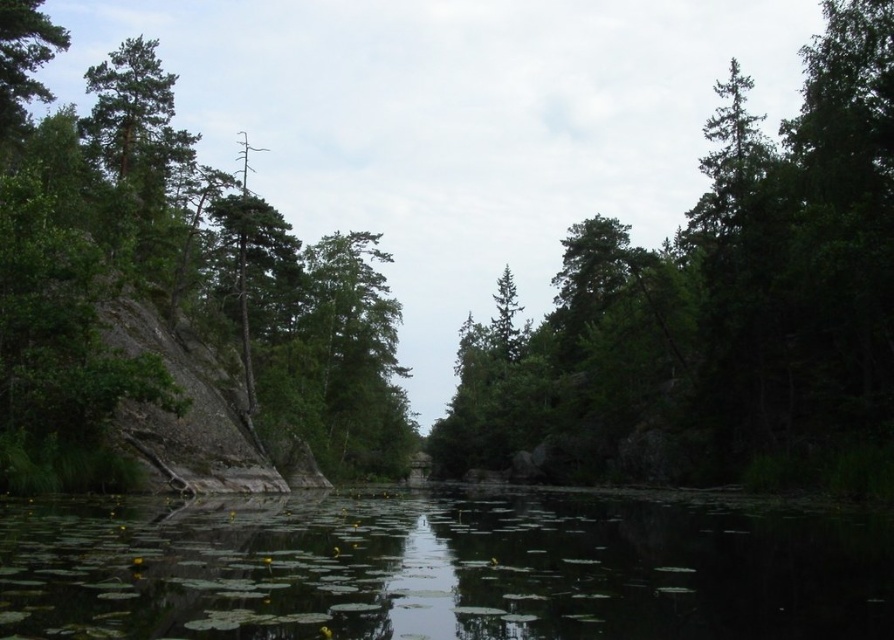
Is green leafy tree at center in front of green leafy river at center?

No, green leafy tree at center is behind green leafy river at center.

Locate an element on the screen. The height and width of the screenshot is (640, 894). green leafy tree at center is located at coordinates (714, 301).

Find the location of a particular element. The height and width of the screenshot is (640, 894). green leafy tree at center is located at coordinates (x=714, y=301).

Between point (620, 355) and point (6, 253), which one is positioned in front?

Point (6, 253)

Is point (650, 355) more distant than point (61, 124)?

Yes, it is behind point (61, 124).

Measure the distance between point (881, 42) and camera.

A distance of 49.57 meters exists between point (881, 42) and camera.

Identify the location of green leafy tree at center. This screenshot has width=894, height=640. (714, 301).

Is green leafy river at center above green rough rock at left?

Incorrect, green leafy river at center is not positioned above green rough rock at left.

You are a GUI agent. You are given a task and a screenshot of the screen. Output one action in this format:
    pyautogui.click(x=<x>, y=<y>)
    Task: Click on the green leafy river at center
    Image resolution: width=894 pixels, height=640 pixels.
    Given the screenshot: What is the action you would take?
    pyautogui.click(x=441, y=570)